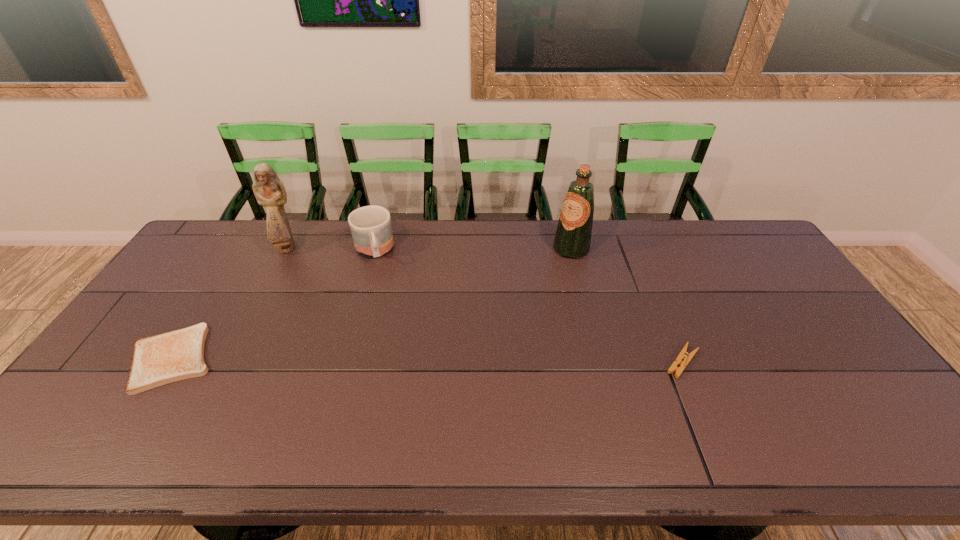
At what (x,y) coordinates should I click in order to perform the action: click on blank area in the image that satisfies the following two spatial constraints: 1. on the back side of the mug; 2. on the left side of the olive oil. Please return your answer as a coordinate pair (x, y). The width and height of the screenshot is (960, 540). Looking at the image, I should click on [x=374, y=248].

I want to click on vacant region that satisfies the following two spatial constraints: 1. on the front side of the clothespin; 2. on the right side of the olive oil, so click(599, 362).